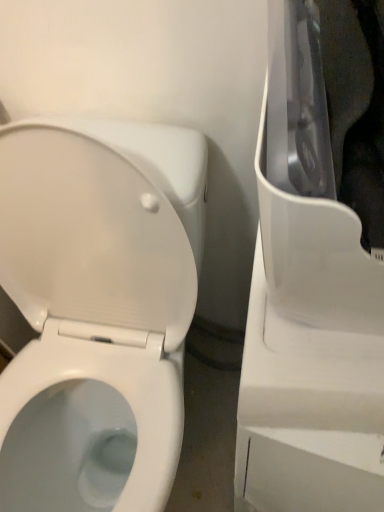
The width and height of the screenshot is (384, 512). What do you see at coordinates (308, 304) in the screenshot? I see `white plastic appliance at right` at bounding box center [308, 304].

At what (x,y) coordinates should I click in order to perform the action: click on white plastic appliance at right. Please return your answer as a coordinate pair (x, y). Image resolution: width=384 pixels, height=512 pixels. Looking at the image, I should click on (308, 304).

This screenshot has height=512, width=384. What do you see at coordinates (97, 309) in the screenshot?
I see `white glossy toilet at left` at bounding box center [97, 309].

This screenshot has height=512, width=384. Find the location of `white glossy toilet at left`. white glossy toilet at left is located at coordinates (97, 309).

Find the location of a particular element. white plastic appliance at right is located at coordinates (308, 304).

Is white plastic appliance at right at the left side of white glossy toilet at left?

No, white plastic appliance at right is not to the left of white glossy toilet at left.

Which object is more forward, white plastic appliance at right or white glossy toilet at left?

white plastic appliance at right is closer to the camera.

Does point (276, 334) lie in front of point (30, 365)?

Yes, point (276, 334) is in front of point (30, 365).

From the image's perspective, does white plastic appliance at right appear lower than white glossy toilet at left?

Yes, from the image's perspective, white plastic appliance at right is below white glossy toilet at left.

From a real-world perspective, is white plastic appliance at right positioned under white glossy toilet at left based on gravity?

No, from a real-world perspective, white plastic appliance at right is not below white glossy toilet at left.

Considering the relative sizes of white plastic appliance at right and white glossy toilet at left in the image provided, is white plastic appliance at right thinner than white glossy toilet at left?

Indeed, white plastic appliance at right has a lesser width compared to white glossy toilet at left.

Considering the sizes of objects white plastic appliance at right and white glossy toilet at left in the image provided, who is taller, white plastic appliance at right or white glossy toilet at left?

white plastic appliance at right.

Does white plastic appliance at right have a smaller size compared to white glossy toilet at left?

Yes.

Choose the correct answer: Is white plastic appliance at right inside white glossy toilet at left or outside it?

white plastic appliance at right is not inside white glossy toilet at left, it's outside.

Are white plastic appliance at right and white glossy toilet at left far apart?

No.

Is white plastic appliance at right aimed at white glossy toilet at left?

No.

Where is `appliance below the white glossy toilet at left (from the image's perspective)`? The image size is (384, 512). appliance below the white glossy toilet at left (from the image's perspective) is located at coordinates (308, 304).

In the image, is white glossy toilet at left on the left side or the right side of white plastic appliance at right?

Based on their positions, white glossy toilet at left is located to the left of white plastic appliance at right.

Between white glossy toilet at left and white plastic appliance at right, which one is positioned in front?

white plastic appliance at right is in front.

Is point (25, 189) positioned after point (278, 255)?

Yes, it is behind point (278, 255).

From the image's perspective, does white glossy toilet at left appear higher than white plastic appliance at right?

Yes, from the image's perspective, white glossy toilet at left is above white plastic appliance at right.

From a real-world perspective, which is physically above, white glossy toilet at left or white plastic appliance at right?

In real-world perspective, white plastic appliance at right is above.

Considering the sizes of objects white glossy toilet at left and white plastic appliance at right in the image provided, who is thinner, white glossy toilet at left or white plastic appliance at right?

Thinner between the two is white plastic appliance at right.

Looking at this image, between white glossy toilet at left and white plastic appliance at right, which one has less height?

Standing shorter between the two is white glossy toilet at left.

Considering the sizes of objects white glossy toilet at left and white plastic appliance at right in the image provided, who is smaller, white glossy toilet at left or white plastic appliance at right?

With smaller size is white plastic appliance at right.

Choose the correct answer: Is white glossy toilet at left inside white plastic appliance at right or outside it?

white glossy toilet at left exists outside the volume of white plastic appliance at right.

Is white glossy toilet at left next to white plastic appliance at right?

They are not placed beside each other.

Does white glossy toilet at left turn towards white plastic appliance at right?

No, white glossy toilet at left does not turn towards white plastic appliance at right.

How many degrees apart are the facing directions of white glossy toilet at left and white plastic appliance at right?

6.5 degrees separate the facing orientations of white glossy toilet at left and white plastic appliance at right.

How far apart are white glossy toilet at left and white plastic appliance at right?

The distance of white glossy toilet at left from white plastic appliance at right is 38.95 centimeters.

Image resolution: width=384 pixels, height=512 pixels. Identify the location of appliance below the white glossy toilet at left (from the image's perspective). (308, 304).

This screenshot has height=512, width=384. In order to click on toilet on the left of white plastic appliance at right in this screenshot , I will do `click(97, 309)`.

You are a GUI agent. You are given a task and a screenshot of the screen. Output one action in this format:
    pyautogui.click(x=<x>, y=<y>)
    Task: Click on the toilet above the white plastic appliance at right (from the image's perspective)
    The height and width of the screenshot is (512, 384).
    Given the screenshot: What is the action you would take?
    pyautogui.click(x=97, y=309)